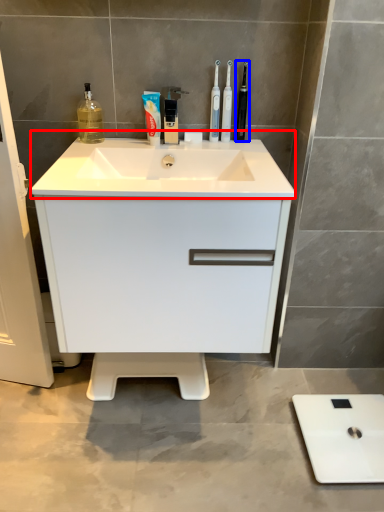
Question: Which point is closer to the camera, sink (highlighted by a red box) or toothbrush (highlighted by a blue box)?

Choices:
 (A) sink
 (B) toothbrush

Answer: (A)